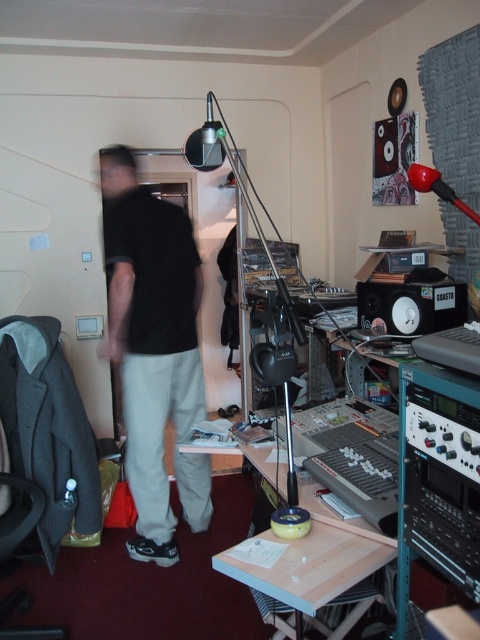
In the home studio scene, there is a person wearing black cotton pants at left and a microphone stand with a red microphone. Which object is closer to the entrance of the room?

The black cotton pants at left are closer to the entrance of the room because they are positioned at point (151, 339), which is near the doorway where the person is standing.